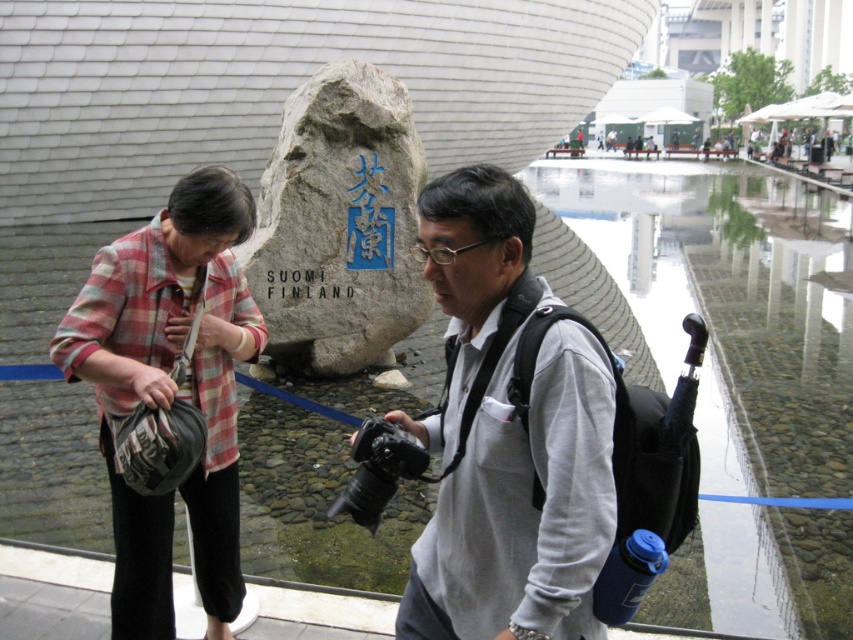
The image size is (853, 640). Find the location of `plaid fabric jacket at left`. plaid fabric jacket at left is located at coordinates (170, 388).

Looking at this image, is plaid fabric jacket at left smaller than gray stone monument at center?

Yes.

The width and height of the screenshot is (853, 640). Describe the element at coordinates (170, 388) in the screenshot. I see `plaid fabric jacket at left` at that location.

Find the location of a particular element. plaid fabric jacket at left is located at coordinates (170, 388).

Which is in front, point (432, 269) or point (73, 324)?

Positioned in front is point (432, 269).

Does gray fabric camera at center appear over plaid fabric jacket at left?

Yes.

Does point (578, 397) lie in front of point (131, 492)?

Yes, it is in front of point (131, 492).

At what (x,y) coordinates should I click in order to perform the action: click on gray fabric camera at center. Please return your answer as a coordinate pair (x, y). This screenshot has height=640, width=853. Looking at the image, I should click on (523, 508).

Is transparent plastic water at lower right thinner than gray stone monument at center?

Incorrect, transparent plastic water at lower right's width is not less than gray stone monument at center's.

Is transparent plastic water at lower right positioned behind gray stone monument at center?

No, it is in front of gray stone monument at center.

Measure the distance between transparent plastic water at lower right and camera.

They are 11.53 feet apart.

You are a GUI agent. You are given a task and a screenshot of the screen. Output one action in this format:
    pyautogui.click(x=<x>, y=<y>)
    Task: Click on the transparent plastic water at lower right
    Image resolution: width=853 pixels, height=640 pixels.
    Given the screenshot: What is the action you would take?
    pyautogui.click(x=730, y=305)